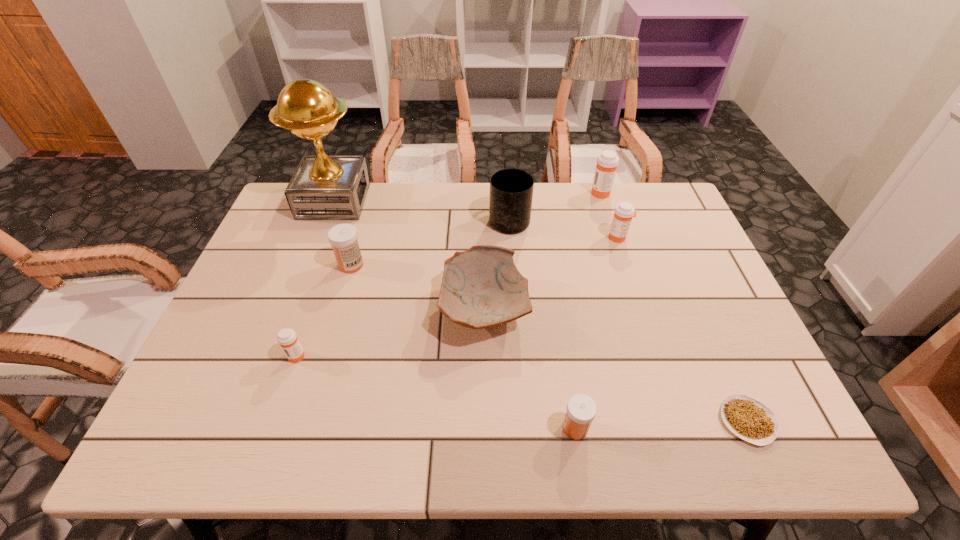
Identify the location of free spot between the tallest medicine and the third medicine from left to right. (588, 310).

At what (x,y) coordinates should I click in order to perform the action: click on vacant space that is in between the third nearest medicine and the pottery. Please return your answer as a coordinate pair (x, y). The width and height of the screenshot is (960, 540). Looking at the image, I should click on (418, 287).

I want to click on unoccupied position between the smaller white medicine and the black mug, so tap(542, 323).

In order to click on free space that is in between the award and the mug in this screenshot , I will do `click(421, 210)`.

I want to click on vacant space that is in between the bigger white medicine and the rightmost object, so click(549, 343).

Image resolution: width=960 pixels, height=540 pixels. Identify the location of free area in between the black mug and the farther white medicine. (430, 241).

In order to click on vacant space that's between the fourth farthest medicine and the pottery in this screenshot , I will do `click(391, 332)`.

Locate which object is the third closest to the pottery. Please provide its 2D coordinates. Your answer should be formatted as a tuple, i.e. [(x, y)], where the tuple contains the x and y coordinates of a point satisfying the conditions above.

[(343, 237)]

Find the location of a particular element. the closest object relative to the gold award is located at coordinates (343, 237).

Locate an element on the screen. medicine that is the fourth closest one to the leftmost orange medicine is located at coordinates (607, 162).